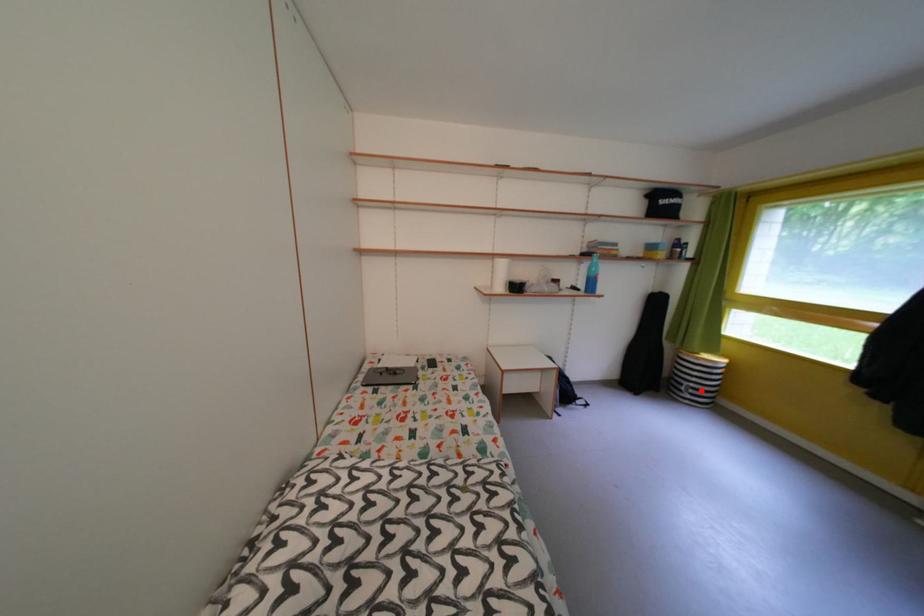
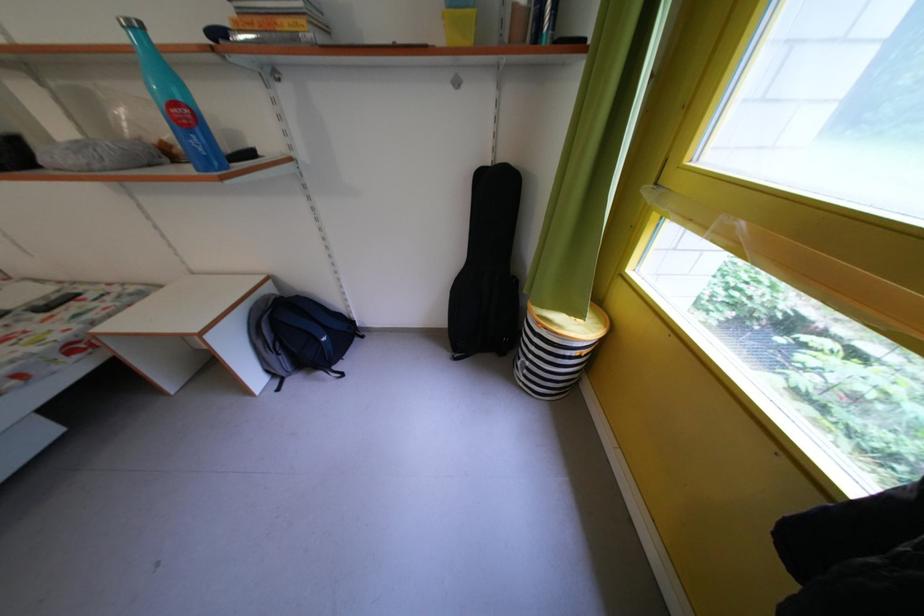
Where in the second image is the point corresponding to the highlighted location from the first image?

(537, 369)